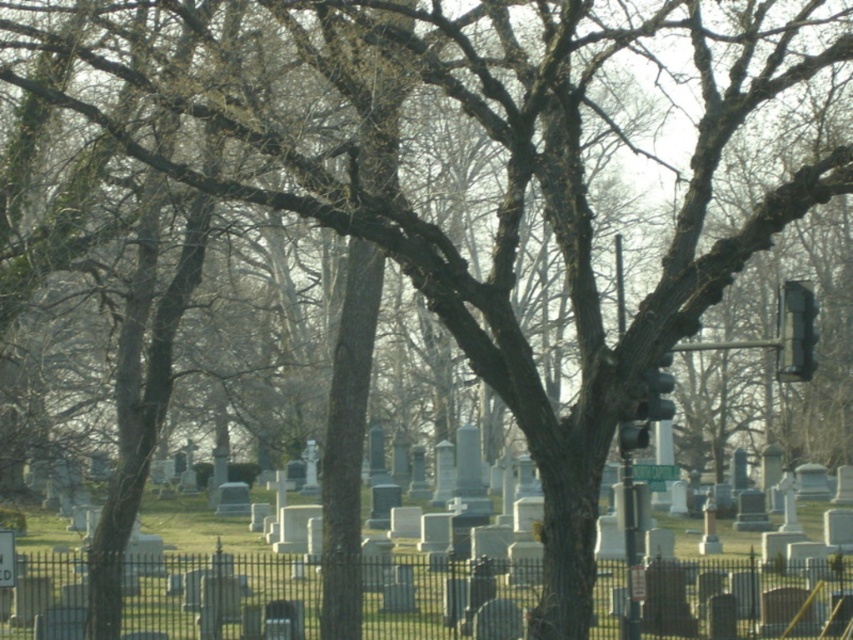
Question: Among these points, which one is nearest to the camera?

Choices:
 (A) (230, 588)
 (B) (788, 284)

Answer: (B)

Question: Is white stone gravestones at center to the right of black plastic traffic light at right from the viewer's perspective?

Choices:
 (A) no
 (B) yes

Answer: (A)

Question: Which of the following is the closest to the observer?

Choices:
 (A) white stone gravestones at center
 (B) black plastic traffic light at right

Answer: (A)

Question: Does white stone gravestones at center appear over black plastic traffic light at right?

Choices:
 (A) yes
 (B) no

Answer: (B)

Question: Can you confirm if white stone gravestones at center is thinner than black plastic traffic light at right?

Choices:
 (A) yes
 (B) no

Answer: (B)